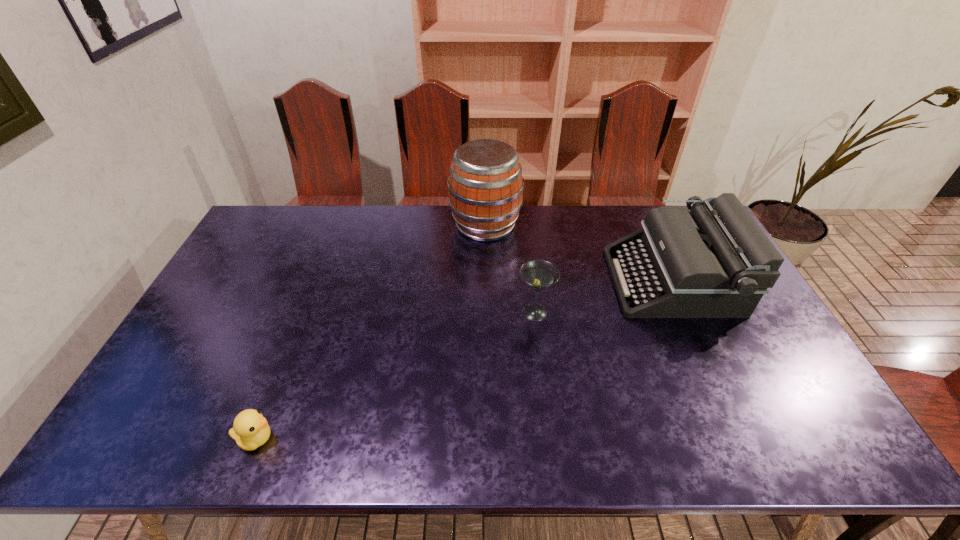
The image size is (960, 540). Identify the location of free space located on the left of the second shortest object. (492, 313).

Locate an element on the screen. This screenshot has width=960, height=540. vacant space situated 0.260m on the face of the duck is located at coordinates (390, 439).

This screenshot has height=540, width=960. In order to click on cider that is positioned at the far edge in this screenshot , I will do `click(485, 186)`.

Identify the location of typewriter present at the far edge. The height and width of the screenshot is (540, 960). (715, 261).

You are a GUI agent. You are given a task and a screenshot of the screen. Output one action in this format:
    pyautogui.click(x=<x>, y=<y>)
    Task: Click on the object present at the near edge
    The width and height of the screenshot is (960, 540).
    Given the screenshot: What is the action you would take?
    pyautogui.click(x=250, y=430)

Find the location of `object that is at the right edge`. object that is at the right edge is located at coordinates (715, 261).

Identify the location of object positioned at the far right corner. This screenshot has width=960, height=540. (715, 261).

In the image, there is a desktop. Where is `vacant region at the far edge`? The image size is (960, 540). vacant region at the far edge is located at coordinates (563, 210).

This screenshot has width=960, height=540. In the image, there is a desktop. Identify the location of free space at the near edge. (444, 421).

Image resolution: width=960 pixels, height=540 pixels. Identify the location of vacant space at the left edge of the desktop. (154, 416).